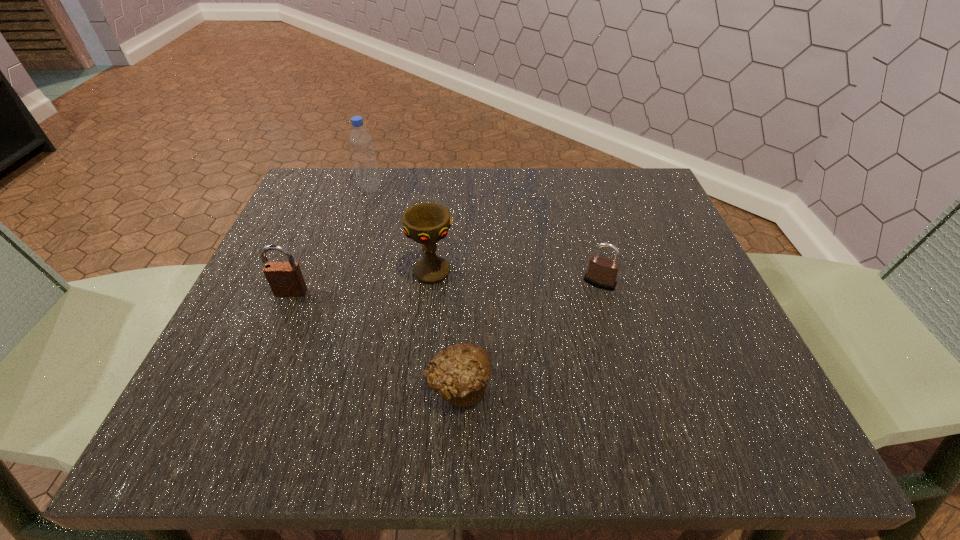
At what (x,y) coordinates should I click in order to perform the action: click on vacant region at the left edge. Please return your answer as a coordinate pair (x, y). This screenshot has width=960, height=540. Looking at the image, I should click on (281, 297).

Identify the location of vacant space at the right edge of the desktop. (691, 269).

This screenshot has height=540, width=960. Identify the location of vacant space at the near left corner of the desktop. (199, 399).

Locate an element on the screen. vacant area between the chalice and the shortest object is located at coordinates (444, 329).

At what (x,y) coordinates should I click in order to perform the action: click on unoccupied position between the left padlock and the tallest object. Please return your answer as a coordinate pair (x, y). The height and width of the screenshot is (540, 960). Looking at the image, I should click on (330, 240).

Find the location of a particular element. vacant space that's between the left padlock and the fourth tallest object is located at coordinates (445, 288).

I want to click on vacant space that's between the tallest object and the chalice, so click(401, 230).

Find the location of a particular element. This screenshot has width=960, height=540. empty space that is in between the chalice and the nearest object is located at coordinates (444, 329).

In order to click on free point between the chalice and the leftmost object in this screenshot , I will do tap(361, 282).

Locate an element on the screen. vacant area that lies between the second object from left to right and the fourth tallest object is located at coordinates (485, 235).